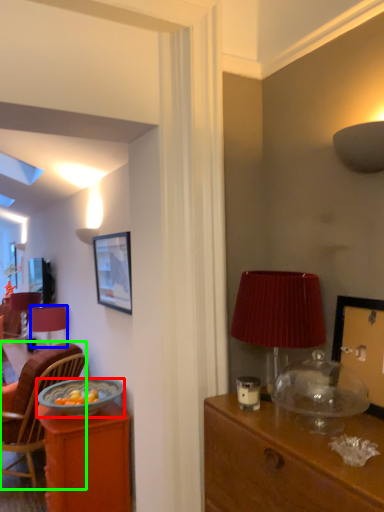
Question: Based on their relative distances, which object is farther from bowl (highlighted by a red box)? Choose from lamp (highlighted by a blue box) and chair (highlighted by a green box).

Choices:
 (A) lamp
 (B) chair

Answer: (A)